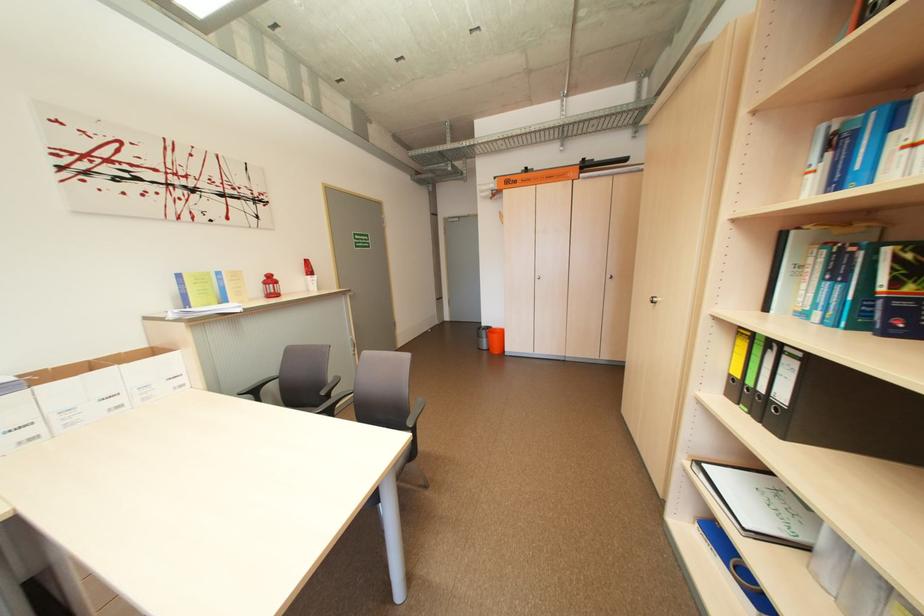
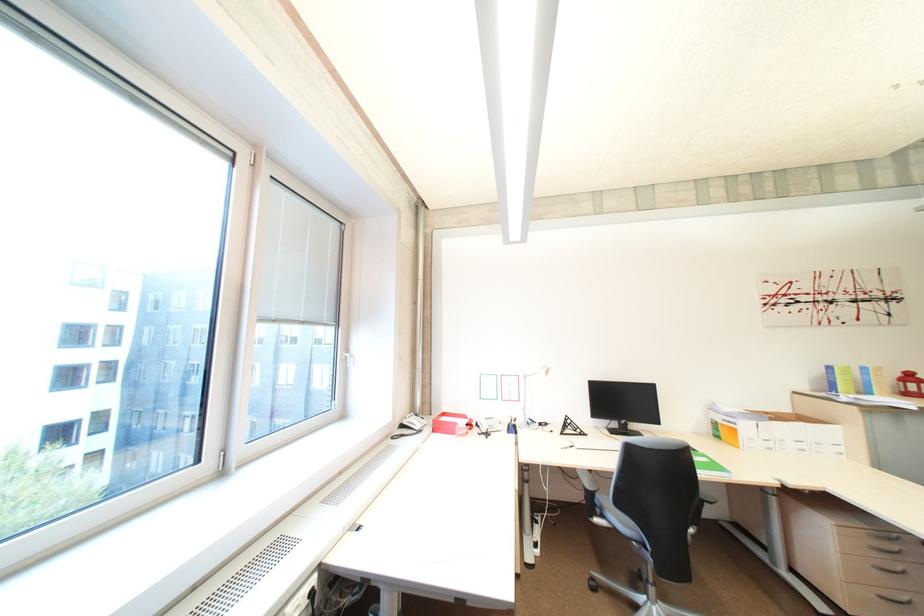
Where in the second image is the point corresponding to the point at 274,284 from the first image?

(913, 382)